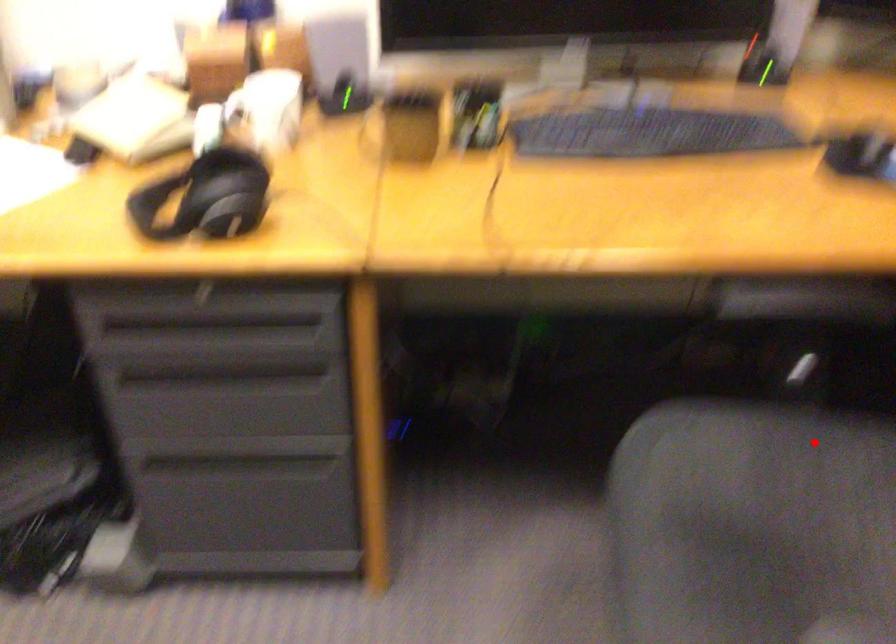
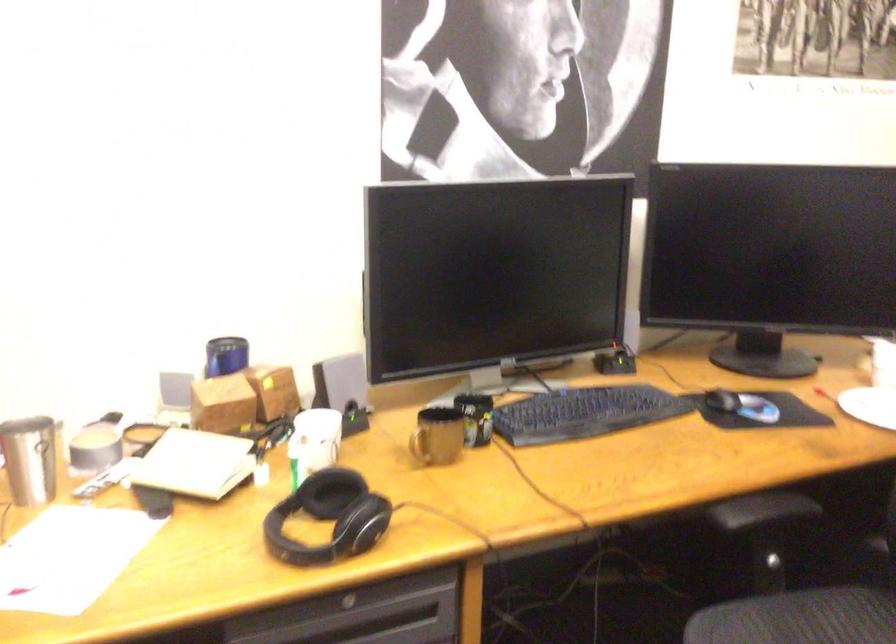
In the second image, find the point that corresponds to the highlighted location in the first image.

(805, 612)